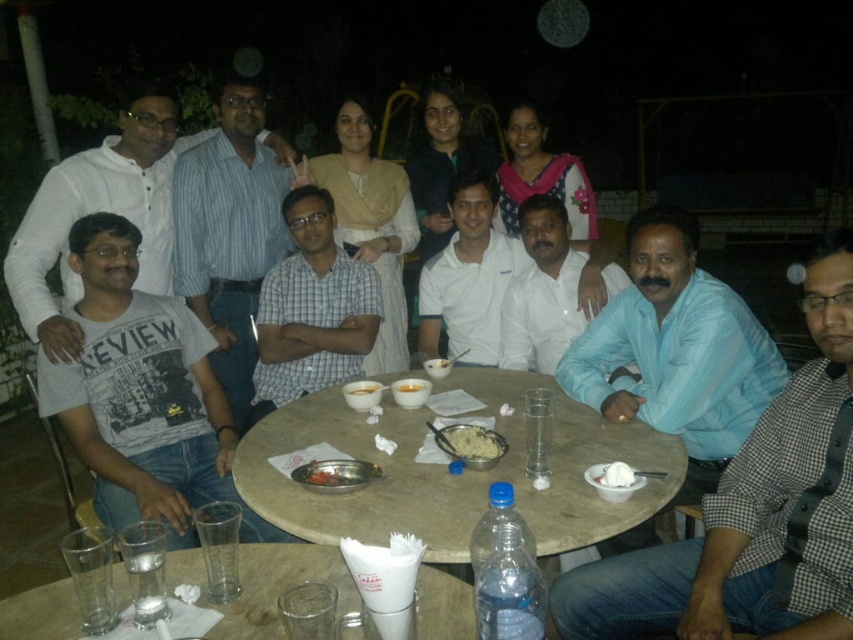
You are a waiter at this outdoor dinner. You need to place a dessert plate on the table. Which bowl should you choose to place the dessert plate on top of, the smooth white bowl at center or the smooth white rice bowl at center, considering their sizes?

The smooth white bowl at center has a larger width than the smooth white rice bowl at center, so you should place the dessert plate on the smooth white bowl at center.

You are standing at the edge of the table and want to reach both the point at coordinate (606,468) and the point at coordinate (332,474). Which point should you reach for first if you want to touch the closest one first?

You should reach for point (606,468) first because it is closer to you than point (332,474).